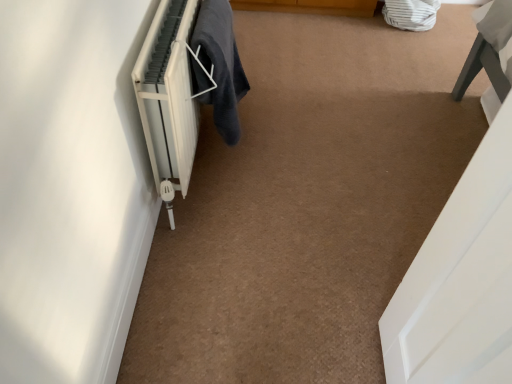
Question: Relative to dark gray fabric at lower left, is white matte radiator at left in front or behind?

Choices:
 (A) behind
 (B) front

Answer: (B)

Question: Choose the correct answer: Is white matte radiator at left inside dark gray fabric at lower left or outside it?

Choices:
 (A) outside
 (B) inside

Answer: (A)

Question: From a real-world perspective, is white matte radiator at left above or below dark gray fabric at lower left?

Choices:
 (A) below
 (B) above

Answer: (A)

Question: Looking at their shapes, would you say dark gray fabric at lower left is wider or thinner than white matte radiator at left?

Choices:
 (A) wide
 (B) thin

Answer: (B)

Question: From a real-world perspective, relative to white matte radiator at left, is dark gray fabric at lower left vertically above or below?

Choices:
 (A) below
 (B) above

Answer: (B)

Question: Considering the positions of point (224, 28) and point (156, 46), is point (224, 28) closer or farther from the camera than point (156, 46)?

Choices:
 (A) farther
 (B) closer

Answer: (A)

Question: From their relative heights in the image, would you say dark gray fabric at lower left is taller or shorter than white matte radiator at left?

Choices:
 (A) short
 (B) tall

Answer: (A)